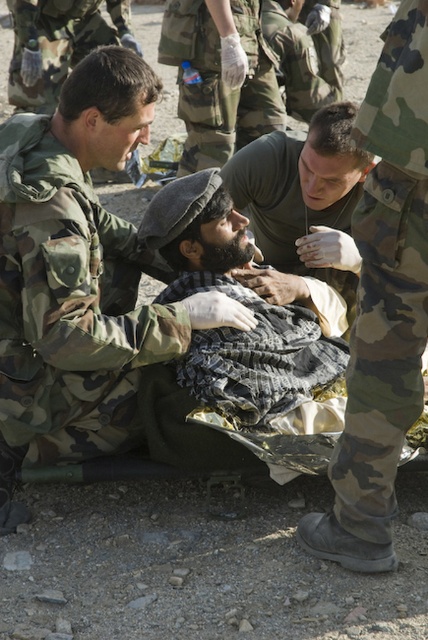
Does camo fabric pants at right have a greater width compared to camouflage fabric uniform at upper left?

No, camo fabric pants at right is not wider than camouflage fabric uniform at upper left.

Is camo fabric pants at right further to camera compared to camouflage fabric uniform at upper left?

No, camo fabric pants at right is closer to the viewer.

Does point (419, 4) come closer to viewer compared to point (14, 72)?

Yes, point (419, 4) is in front of point (14, 72).

Locate an element on the screen. Image resolution: width=428 pixels, height=640 pixels. camo fabric pants at right is located at coordinates (386, 282).

Is dark gray fabric at center bigger than camouflage fabric uniform at upper left?

Yes, dark gray fabric at center is bigger than camouflage fabric uniform at upper left.

This screenshot has height=640, width=428. What do you see at coordinates (243, 305) in the screenshot?
I see `dark gray fabric at center` at bounding box center [243, 305].

Which is in front, point (168, 205) or point (115, 26)?

Point (168, 205) is more forward.

What are the coordinates of `dark gray fabric at center` in the screenshot? It's located at (243, 305).

Who is positioned more to the right, matte green uniform at center or camouflage fabric uniform at upper left?

matte green uniform at center is more to the right.

Identify the location of matte green uniform at center. (305, 198).